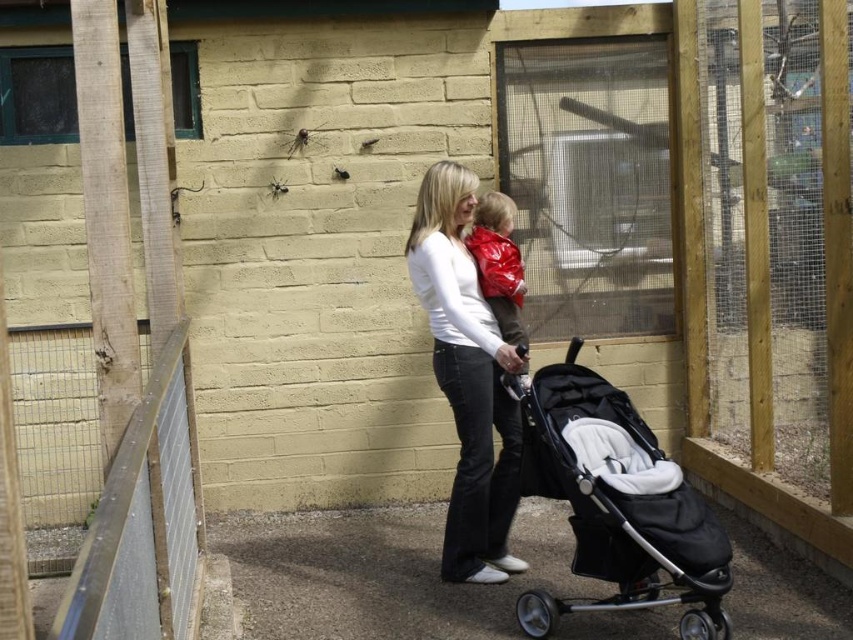
Is clear mesh screen door at center behind shiny red jacket at center?

Yes, clear mesh screen door at center is further from the viewer.

Based on the photo, which is more to the left, clear mesh screen door at center or shiny red jacket at center?

shiny red jacket at center is more to the left.

Which is in front, point (578, 195) or point (512, 340)?

Point (512, 340)

The height and width of the screenshot is (640, 853). In order to click on clear mesh screen door at center in this screenshot , I will do `click(589, 182)`.

Between black fabric stroller at lower right and white matte shirt at center, which one is positioned higher?

white matte shirt at center

Who is positioned more to the left, black fabric stroller at lower right or white matte shirt at center?

white matte shirt at center is more to the left.

Who is more forward, (566, 392) or (477, 497)?

Point (566, 392)

At what (x,y) coordinates should I click in order to perform the action: click on black fabric stroller at lower right. Please return your answer as a coordinate pair (x, y). The image size is (853, 640). Looking at the image, I should click on (618, 504).

Can you confirm if clear mesh screen door at center is positioned above white matte shirt at center?

Yes, clear mesh screen door at center is above white matte shirt at center.

Who is more forward, [613,259] or [486,314]?

Point [486,314] is in front.

You are a GUI agent. You are given a task and a screenshot of the screen. Output one action in this format:
    pyautogui.click(x=<x>, y=<y>)
    Task: Click on the clear mesh screen door at center
    The image size is (853, 640).
    Given the screenshot: What is the action you would take?
    pyautogui.click(x=589, y=182)

At what (x,y) coordinates should I click in order to perform the action: click on clear mesh screen door at center. Please return your answer as a coordinate pair (x, y). Looking at the image, I should click on (589, 182).